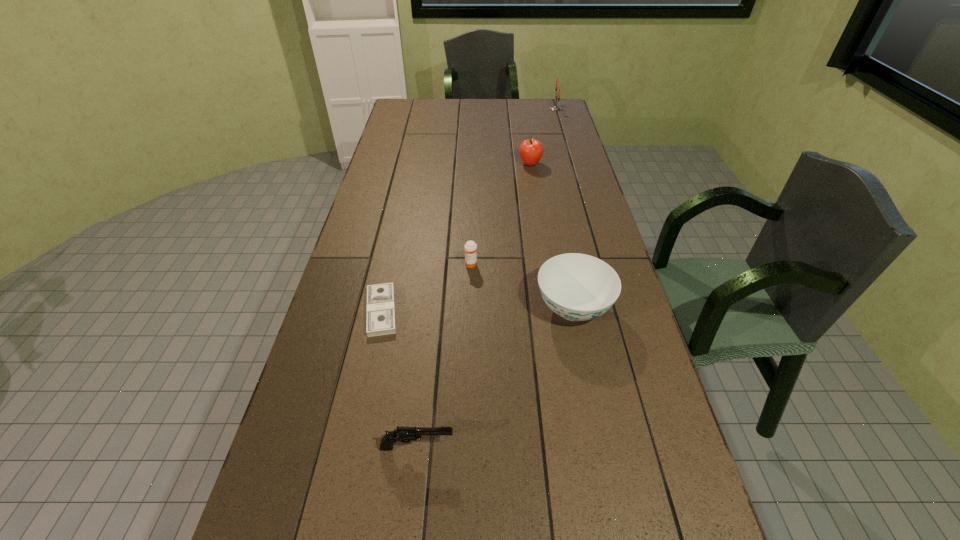
This screenshot has width=960, height=540. In order to click on vacant space in between the second farthest object and the candle in this screenshot , I will do pos(542,137).

Identify the location of vacant space that is in between the fifth nearest object and the chinaware. Image resolution: width=960 pixels, height=540 pixels. (552, 236).

The width and height of the screenshot is (960, 540). In order to click on vacant area between the second farthest object and the gun in this screenshot , I will do `click(473, 306)`.

Locate an element on the screen. unoccupied position between the fifth object from right to left and the fourth object from right to left is located at coordinates (444, 356).

The image size is (960, 540). In order to click on unoccupied area between the leftmost object and the third farthest object in this screenshot , I will do (426, 288).

I want to click on object that stands as the closest to the fourth object from right to left, so click(578, 287).

Locate which object ranks second in proximity to the farthest object. Please provide its 2D coordinates. Your answer should be formatted as a tuple, i.e. [(x, y)], where the tuple contains the x and y coordinates of a point satisfying the conditions above.

[(470, 247)]

In order to click on free spot that satisfies the following two spatial constraints: 1. on the back side of the chinaware; 2. on the left side of the leftmost object in this screenshot , I will do `click(382, 308)`.

You are a GUI agent. You are given a task and a screenshot of the screen. Output one action in this format:
    pyautogui.click(x=<x>, y=<y>)
    Task: Click on the free space that satisfies the following two spatial constraints: 1. on the front-facing side of the candle; 2. on the front side of the medicine
    The width and height of the screenshot is (960, 540).
    Given the screenshot: What is the action you would take?
    pyautogui.click(x=601, y=265)

The width and height of the screenshot is (960, 540). I want to click on free space that satisfies the following two spatial constraints: 1. on the front side of the fifth nearest object; 2. at the end of the barrel of the nearest object, so click(575, 447).